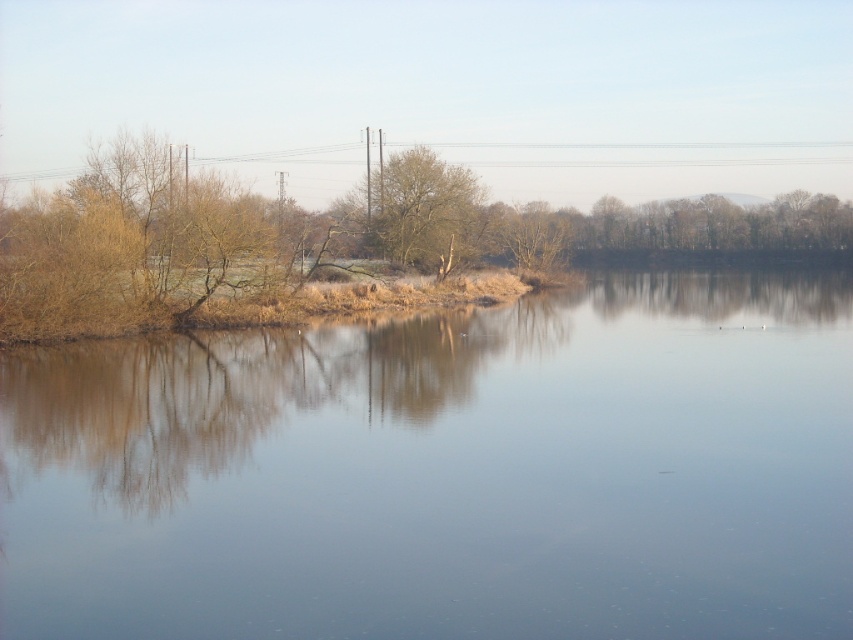
Is brown/dry grass at left to the right of brown textured tree at center from the viewer's perspective?

In fact, brown/dry grass at left is to the left of brown textured tree at center.

Locate an element on the screen. Image resolution: width=853 pixels, height=640 pixels. brown/dry grass at left is located at coordinates (323, 241).

Who is more distant from viewer, (x=705, y=212) or (x=434, y=180)?

Point (x=705, y=212)

Find the location of `brown/dry grass at left`. brown/dry grass at left is located at coordinates (323, 241).

Between smooth water at center and brown textured tree at center, which one has less height?

Standing shorter between the two is smooth water at center.

Measure the distance between smooth water at center and camera.

smooth water at center and camera are 8.90 meters apart.

Locate an element on the screen. This screenshot has width=853, height=640. smooth water at center is located at coordinates (445, 472).

Is smooth water at center thinner than brown/dry grass at left?

Indeed, smooth water at center has a lesser width compared to brown/dry grass at left.

Who is lower down, smooth water at center or brown/dry grass at left?

smooth water at center is below.

Describe the element at coordinates (445, 472) in the screenshot. I see `smooth water at center` at that location.

Image resolution: width=853 pixels, height=640 pixels. I want to click on smooth water at center, so click(x=445, y=472).